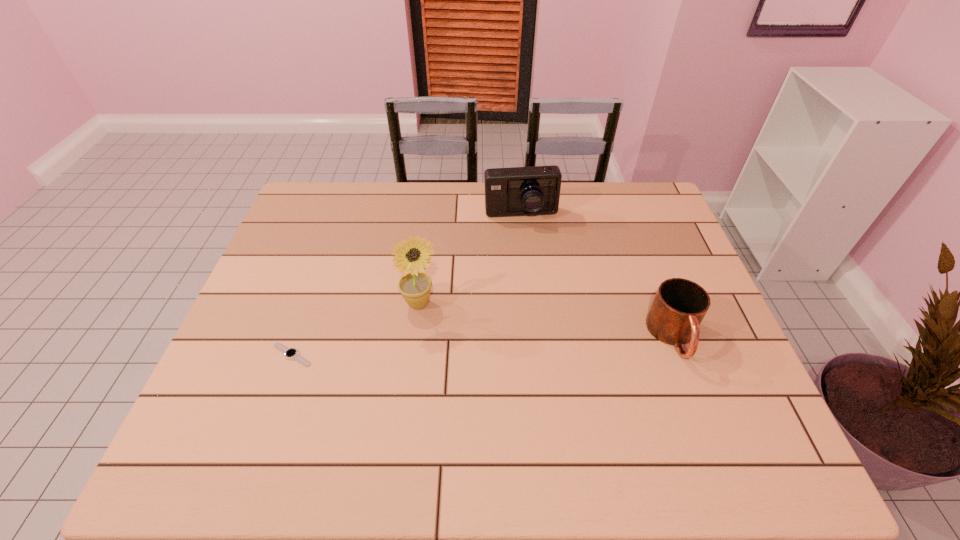
The image size is (960, 540). Identify the location of free spot located 0.320m on the front-facing side of the second object from right to left. (534, 301).

This screenshot has height=540, width=960. What are the coordinates of `free location located on the front-facing side of the second object from right to left` in the screenshot? It's located at (525, 240).

Where is `vacant region located on the front-facing side of the second object from right to left`? vacant region located on the front-facing side of the second object from right to left is located at coordinates (533, 298).

Find the location of `free spot located on the face of the sunflower`. free spot located on the face of the sunflower is located at coordinates (562, 377).

The height and width of the screenshot is (540, 960). I want to click on free spot located 0.060m on the face of the sunflower, so click(x=454, y=320).

At what (x,y) coordinates should I click in order to perform the action: click on free region located 0.100m on the face of the sunflower. Please return your answer as a coordinate pair (x, y). The height and width of the screenshot is (540, 960). Looking at the image, I should click on (467, 326).

This screenshot has height=540, width=960. I want to click on object that is positioned at the far edge, so click(517, 191).

Find the location of a particular element. This screenshot has height=540, width=960. object at the left edge is located at coordinates (290, 353).

Locate an element on the screen. This screenshot has width=960, height=540. object present at the right edge is located at coordinates (679, 306).

Identify the location of free region at the far edge. The image size is (960, 540). (386, 205).